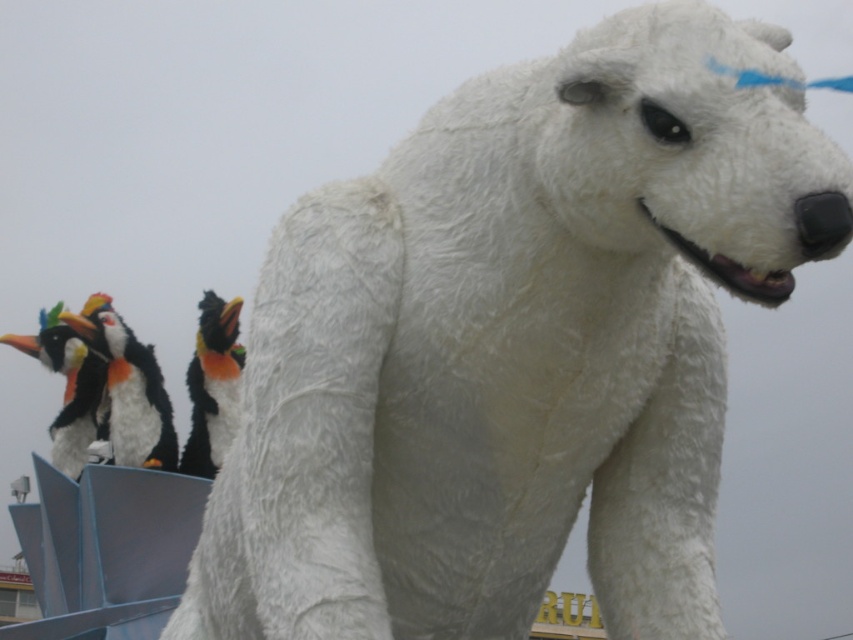
You are standing at a point in a park where you can see a large white polar bear sculpture and a group of penguin sculptures. You want to know the distance from your current position to the point marked as point (207, 440). Can you determine if this distance is more than 100 meters?

The point (207, 440) is 107.01 meters away from the viewer, so yes, the distance is more than 100 meters.

In the scene shown: You are an art curator examining the polar bear sculpture and the black plush penguin at left. You notice some black and orange feathers at left near the base of the penguin. Where are these feathers located in relation to the penguin?

The black and orange feathers at left are positioned under the black plush penguin at left, indicating they might be part of its base or fallen from it.

You are an artist trying to recreate the scene. You have a limited amount of orange paint. Which object in the image requires less orange paint to depict the black and orange feathers at left compared to the fluffy white penguin at left?

The black and orange feathers at left requires less orange paint because its width is smaller than the fluffy white penguin at left.